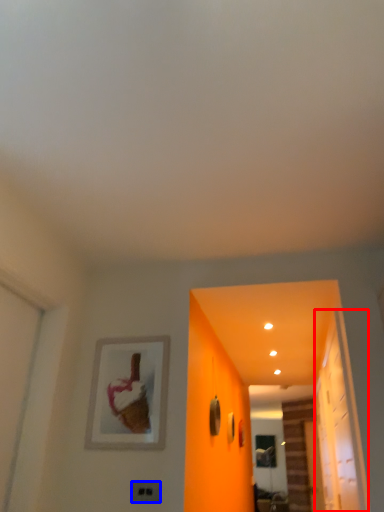
Question: Which of the following is the farthest to the observer, glass door (highlighted by a red box) or electric outlet (highlighted by a blue box)?

Choices:
 (A) glass door
 (B) electric outlet

Answer: (B)